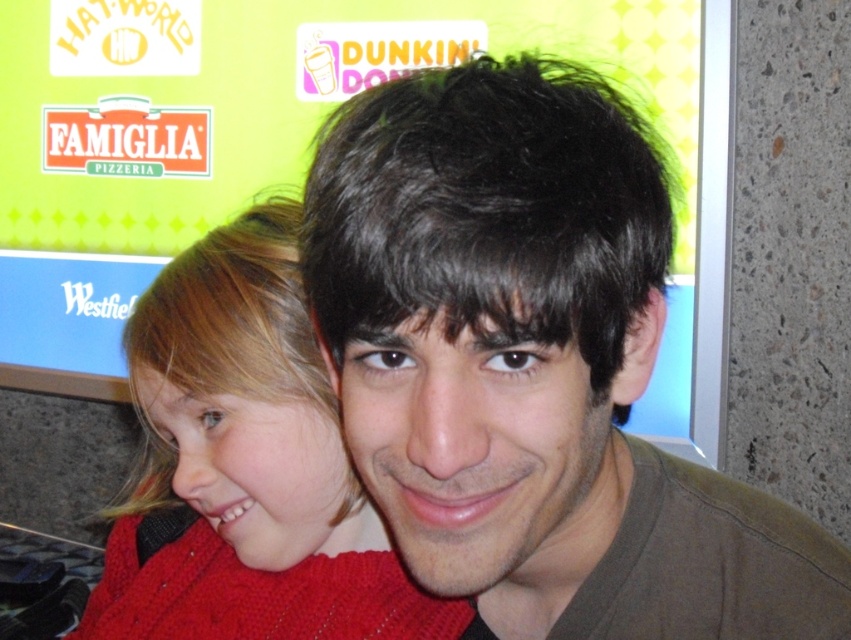
You are holding a 12 inch ruler and want to measure the distance from your eyes to the point at coordinates point (524, 67) in the image. Can you reach it with your ruler?

The distance of point (524, 67) from viewer is 15.97 inches, so the ruler is 12 inches long, which is shorter than the distance. You cannot reach it with your ruler.

You are a photographer trying to capture a candid shot of the brown matte hair at center and the black matte hair at center. Since you want to ensure both are visible in the frame, which one should you focus on first to make sure they are both in focus?

You should focus on the brown matte hair at center first because the black matte hair at center is behind it, so ensuring the front subject is in focus will naturally include the one behind within the depth of field.

You are standing in front of the advertisement board with logos like Hat World and Dunkin Donuts. You see a point marked at coordinates (x=532, y=368). What object is located at that point?

The brown matte hair at center is located at point (x=532, y=368).